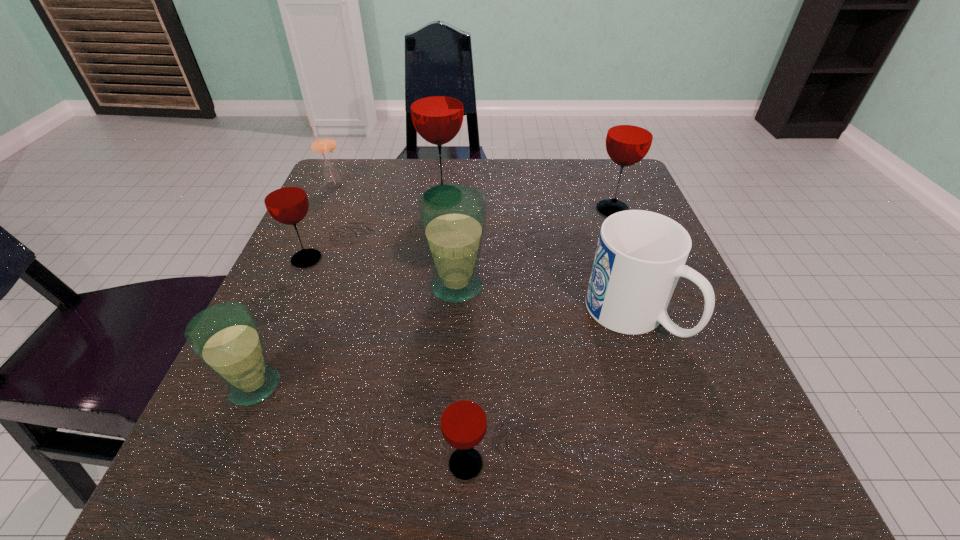
In order to click on vacant space located 0.260m on the right of the left blue glass in this screenshot , I will do `click(463, 386)`.

Identify the location of free space located on the right of the nearest object. The width and height of the screenshot is (960, 540). (622, 464).

Locate an element on the screen. The width and height of the screenshot is (960, 540). straw that is positioned at the far edge is located at coordinates (323, 144).

This screenshot has width=960, height=540. Find the location of `object located at the near edge`. object located at the near edge is located at coordinates (463, 420).

Identify the location of straw that is at the left edge. (323, 144).

This screenshot has width=960, height=540. I want to click on glass positioned at the right edge, so click(629, 137).

The width and height of the screenshot is (960, 540). I want to click on mug situated at the right edge, so click(640, 255).

The height and width of the screenshot is (540, 960). Find the location of `object situated at the far left corner`. object situated at the far left corner is located at coordinates (323, 144).

Where is `object that is at the far right corner`? The width and height of the screenshot is (960, 540). object that is at the far right corner is located at coordinates (629, 137).

Where is `free space at the far edge of the desktop`? Image resolution: width=960 pixels, height=540 pixels. free space at the far edge of the desktop is located at coordinates (561, 173).